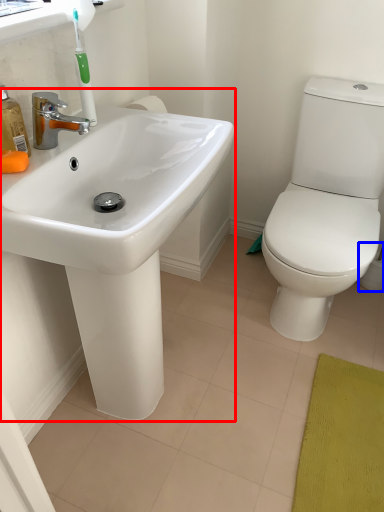
Question: Among these objects, which one is nearest to the camera, sink (highlighted by a red box) or toilet paper (highlighted by a blue box)?

Choices:
 (A) sink
 (B) toilet paper

Answer: (A)